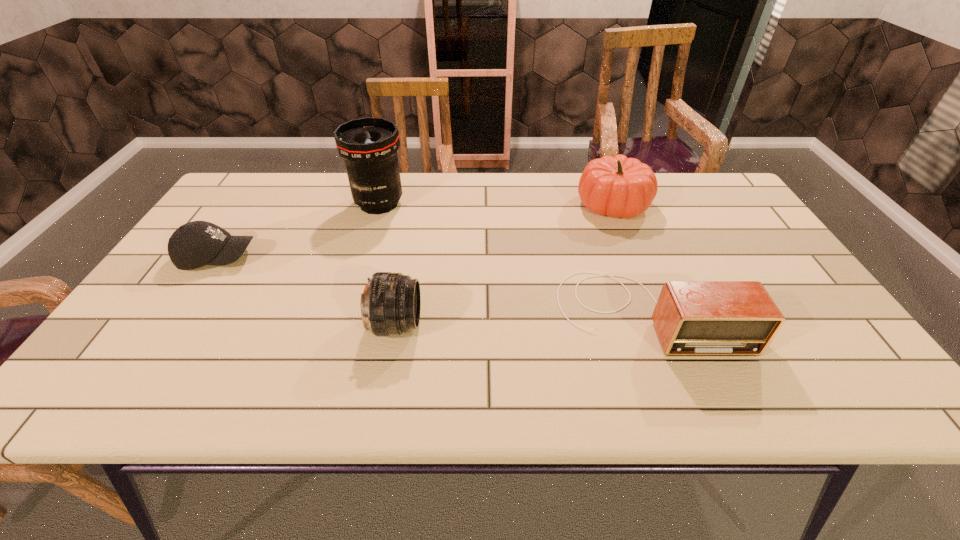
This screenshot has width=960, height=540. What are the coordinates of `free space at the far right corner` in the screenshot? It's located at (693, 197).

Where is `vacant space at the near right corner`? This screenshot has width=960, height=540. vacant space at the near right corner is located at coordinates (801, 383).

I want to click on vacant region between the shorter telephoto lens and the shortest object, so click(x=307, y=291).

You are a GUI agent. You are given a task and a screenshot of the screen. Output one action in this format:
    pyautogui.click(x=<x>, y=<y>)
    Task: Click on the vacant space in between the baseball cap and the tallest object
    Image resolution: width=960 pixels, height=540 pixels.
    Given the screenshot: What is the action you would take?
    pyautogui.click(x=299, y=230)

Find the location of a particular element. The width and height of the screenshot is (960, 540). empty space between the pumpkin and the tallest object is located at coordinates [496, 204].

Identify the location of empty space that is in between the nearer telephoto lens and the shortest object. This screenshot has height=540, width=960. (307, 291).

This screenshot has height=540, width=960. I want to click on unoccupied position between the taller telephoto lens and the leftmost object, so click(299, 230).

The width and height of the screenshot is (960, 540). I want to click on free space between the farther telephoto lens and the pumpkin, so click(x=496, y=204).

At what (x,y) coordinates should I click in order to perform the action: click on free spot between the nearer telephoto lens and the leftmost object. Please return your answer as a coordinate pair (x, y). Looking at the image, I should click on (307, 291).

I want to click on free space between the nearer telephoto lens and the pumpkin, so click(505, 265).